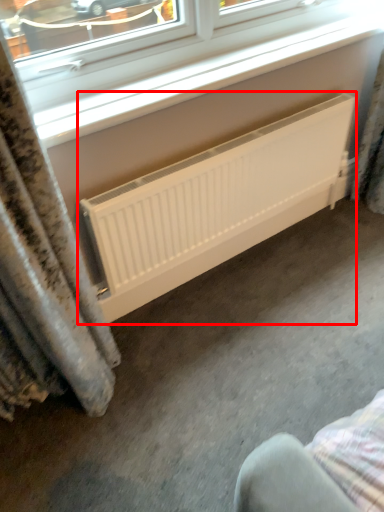
Question: From the image's perspective, what is the correct spatial positioning of radiator (annotated by the red box) in reference to window?

Choices:
 (A) below
 (B) above

Answer: (A)